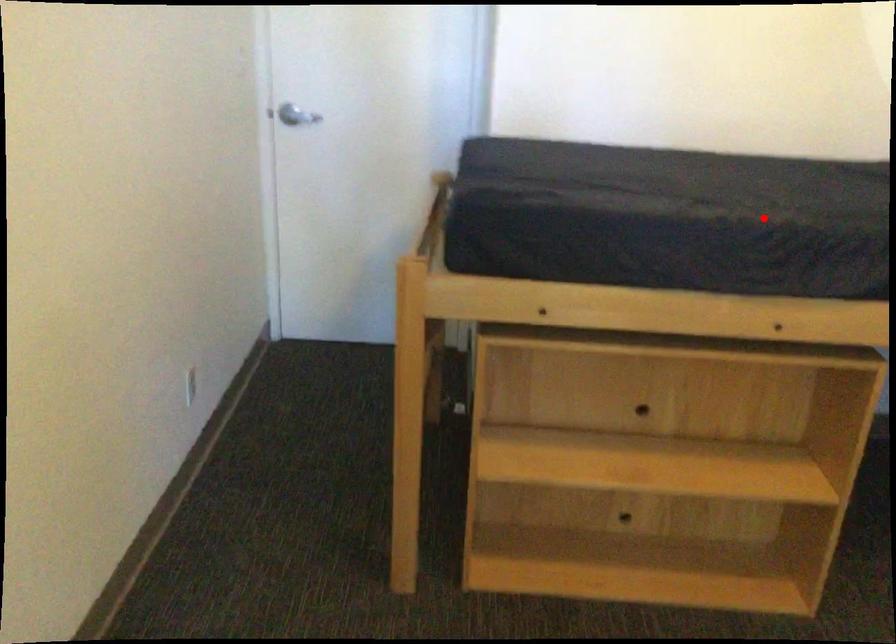
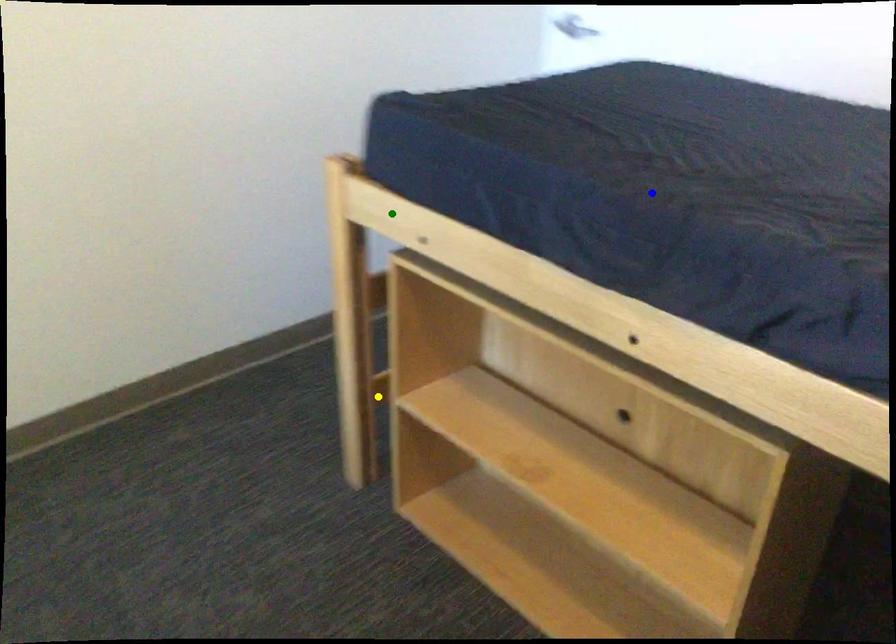
Question: I am providing you with two images of the same scene from different viewpoints. A red point is marked on the first image. You are given multiple points on the second image. Can you choose the point in image 2 that corresponds to the point in image 1?

Choices:
 (A) yellow point
 (B) green point
 (C) blue point

Answer: (C)